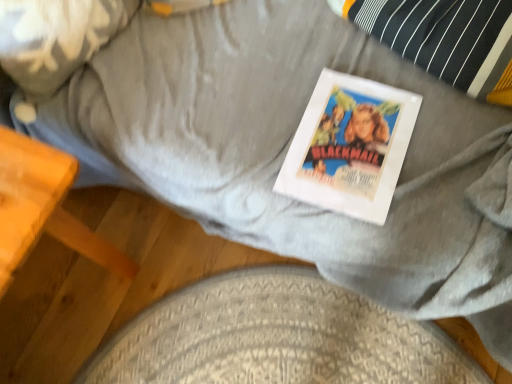
This screenshot has height=384, width=512. I want to click on free space above textured gray dog bed at lower center (from a real-world perspective), so click(x=270, y=334).